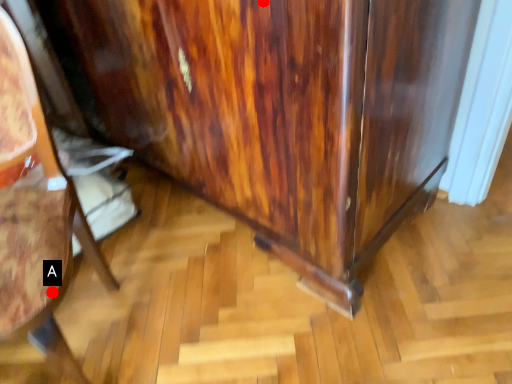
Question: Two points are circled on the image, labeled by A and B beside each circle. Among these points, which one is farthest from the camera?

Choices:
 (A) A is further
 (B) B is further

Answer: (A)